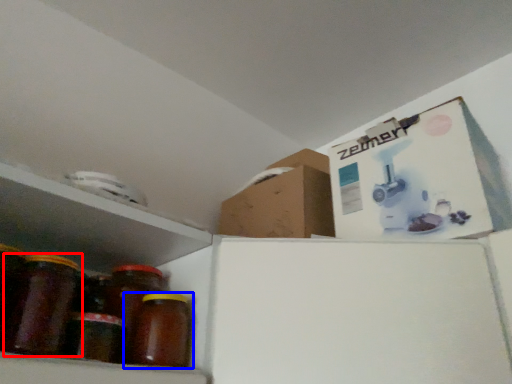
Question: Which point is further to the camera, bottle (highlighted by a red box) or bottle (highlighted by a blue box)?

Choices:
 (A) bottle
 (B) bottle

Answer: (B)